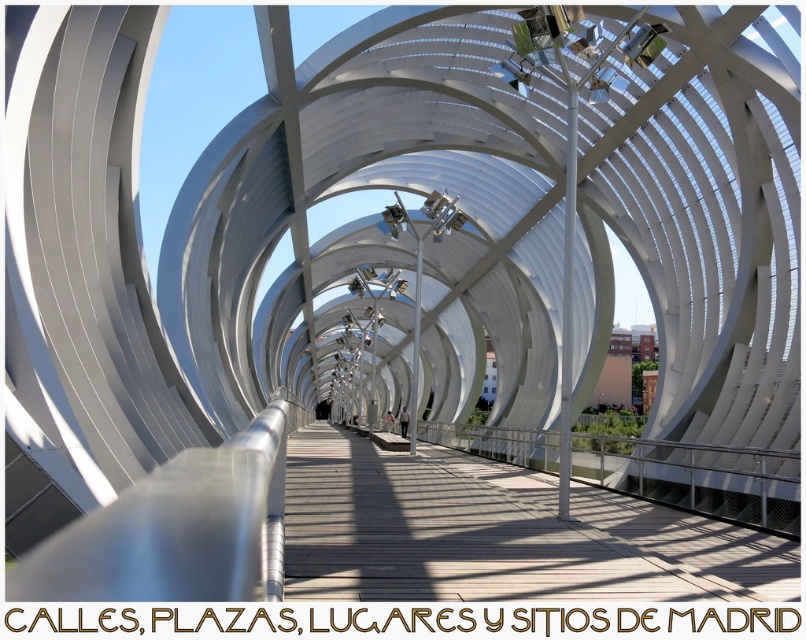
From the picture: You are a maintenance worker inspecting the wooden walkway at center and the silver metallic rail at center. Which one is positioned higher from the ground?

The wooden walkway at center is above the silver metallic rail at center, so the wooden walkway at center is higher from the ground.

In the scene shown: You are standing at the entrance of the pedestrian bridge and want to reach the wooden walkway at center. Which direction should you move in to reach it?

The wooden walkway at center is located at point coordinates of (499, 534), so you should move forward along the bridge towards the center to reach it.

You are standing on the wooden walkway at center and want to grab the silver metallic rail at center for balance. Can you reach it without moving your feet?

The wooden walkway at center is closer to the viewer than the silver metallic rail at center, so yes, you can reach the silver metallic rail at center without moving your feet because it is positioned farther away from you.